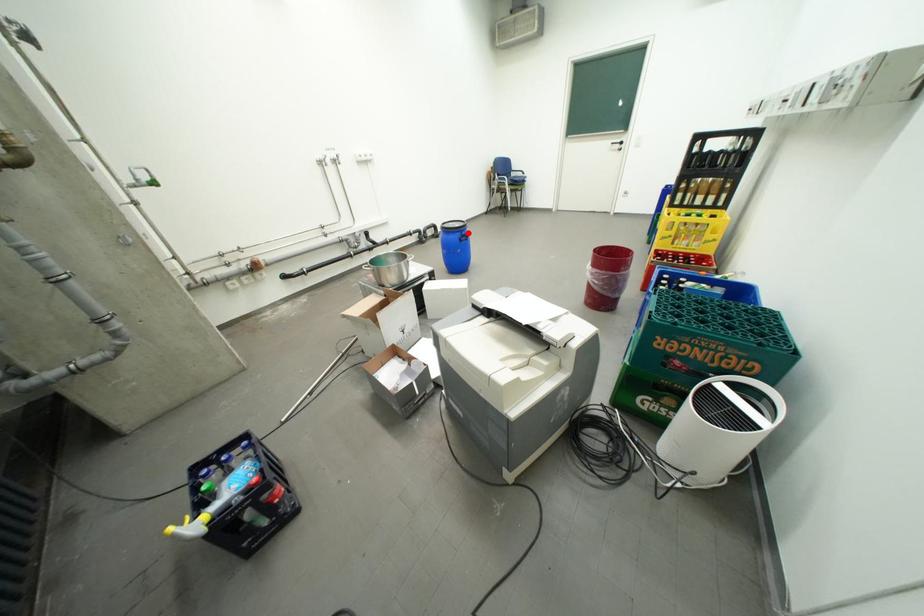
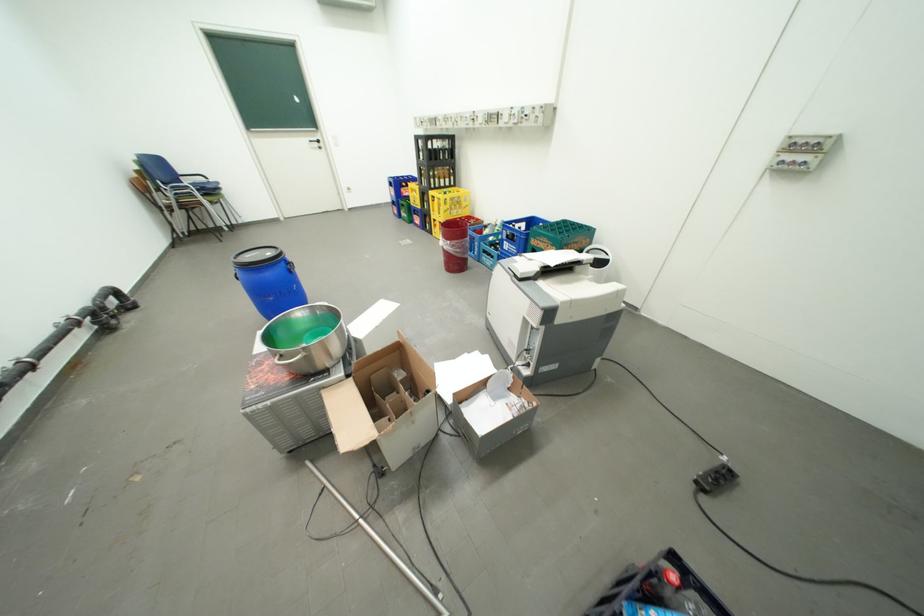
The point at the highlighted location is marked in the first image. Where is the corresponding point in the second image?

(290, 262)